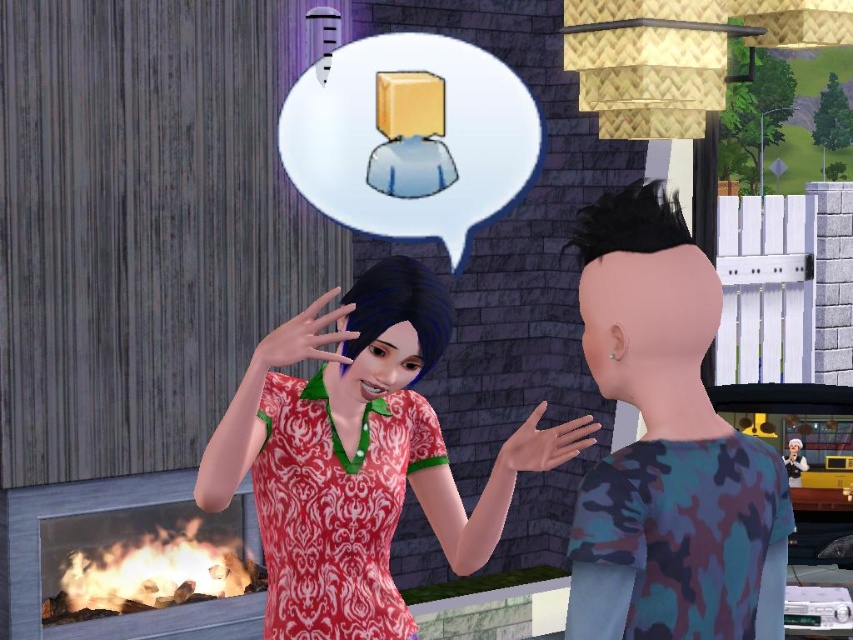
Is camouflage shirt at right smaller than dull red fabric dress at center?

Actually, camouflage shirt at right might be larger than dull red fabric dress at center.

Between point (577, 596) and point (306, 464), which one is positioned in front?

Positioned in front is point (577, 596).

Where is `camouflage shirt at right`? The width and height of the screenshot is (853, 640). camouflage shirt at right is located at coordinates (664, 442).

Between point (207, 499) and point (665, 509), which one is positioned in front?

Point (665, 509) is more forward.

Which of these two, patterned fabric dress at center or camouflage shirt at right, stands shorter?

camouflage shirt at right

This screenshot has width=853, height=640. What are the coordinates of `patterned fabric dress at center` in the screenshot? It's located at (358, 458).

Is patterned fabric dress at center taller than dull red fabric dress at center?

Yes, patterned fabric dress at center is taller than dull red fabric dress at center.

Which is in front, point (476, 554) or point (277, 442)?

Positioned in front is point (277, 442).

Find the location of `patterned fabric dress at center`. patterned fabric dress at center is located at coordinates (358, 458).